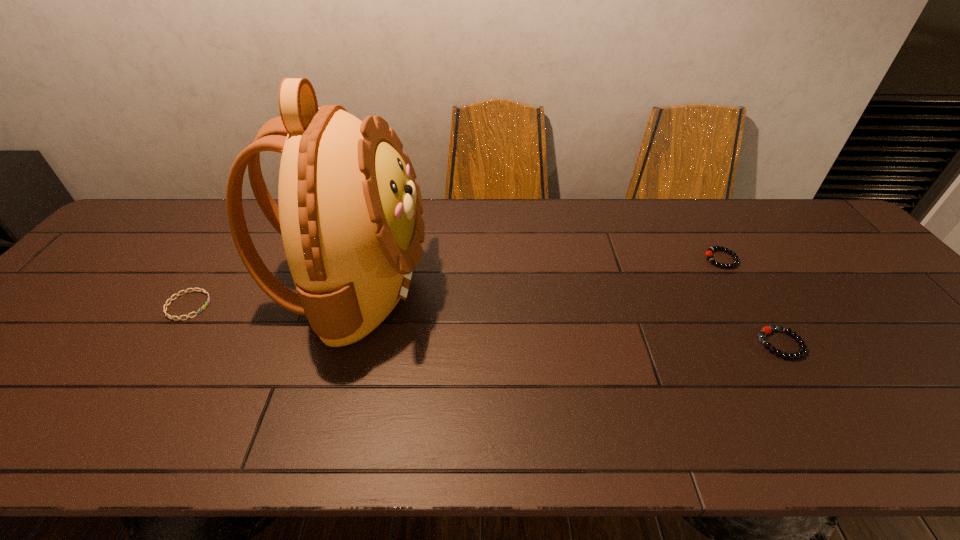
Locate an element on the screen. vacant space that satisfies the following two spatial constraints: 1. on the front side of the nearest bracelet; 2. on the right side of the farthest bracelet is located at coordinates (773, 344).